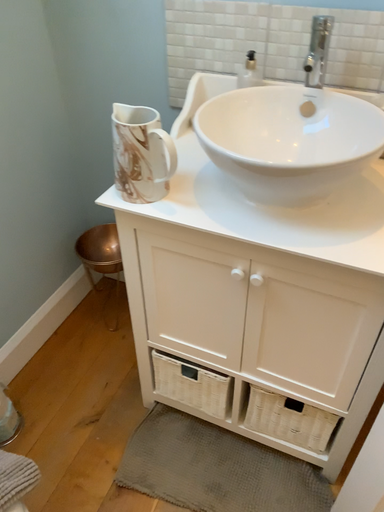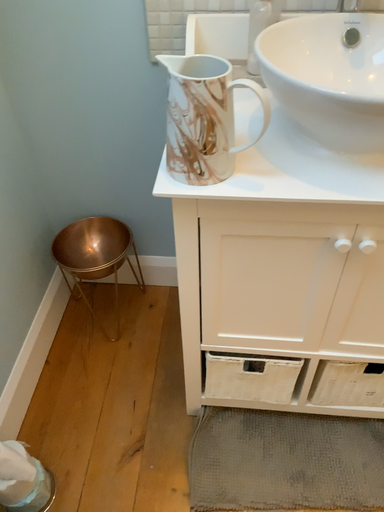
Question: Which way did the camera rotate in the video?

Choices:
 (A) rotated right
 (B) rotated left

Answer: (A)